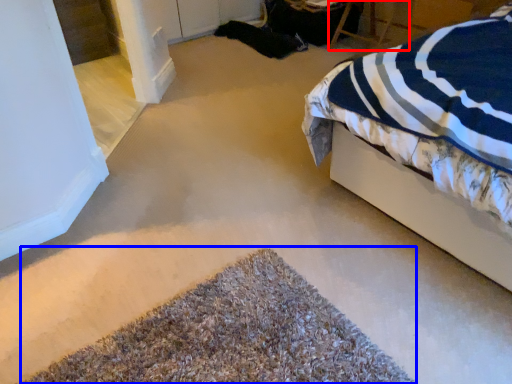
Question: Which object is closer to the camera taking this photo, chair (highlighted by a red box) or door (highlighted by a blue box)?

Choices:
 (A) chair
 (B) door

Answer: (B)